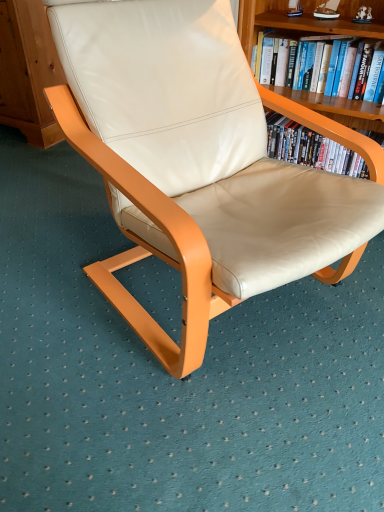
The image size is (384, 512). I want to click on vacant space underneath beige leather chair at center (from a real-world perspective), so click(223, 312).